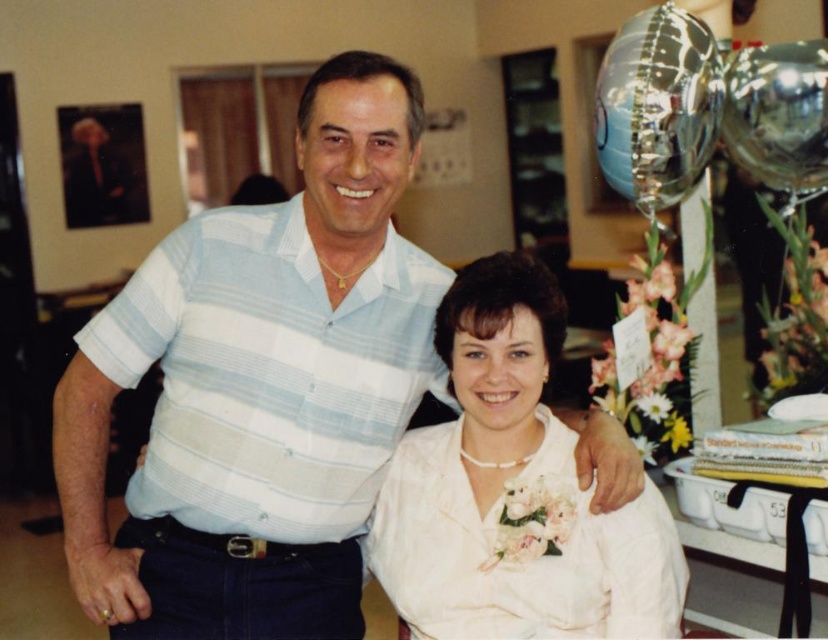
You are taking a photo of the scene and want to focus on the two points in the image. Which point, point (244,568) or point (626,528), is closer to the camera?

Point (244,568) is closer to the camera than point (626,528).

Where is the light blue striped shirt at center located in the image?

The light blue striped shirt at center is located at point 0.606 on the x axis and 0.315 on the y axis.